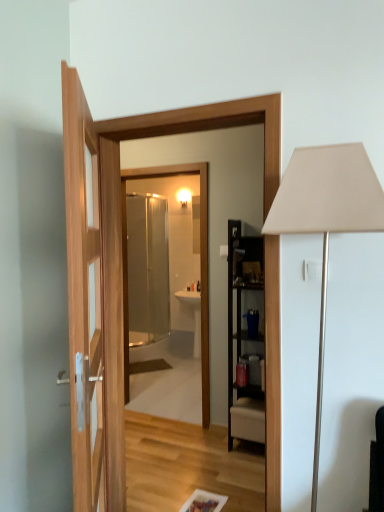
This screenshot has width=384, height=512. I want to click on vacant region under transparent glass mirror at center (from a real-world perspective), so click(x=157, y=417).